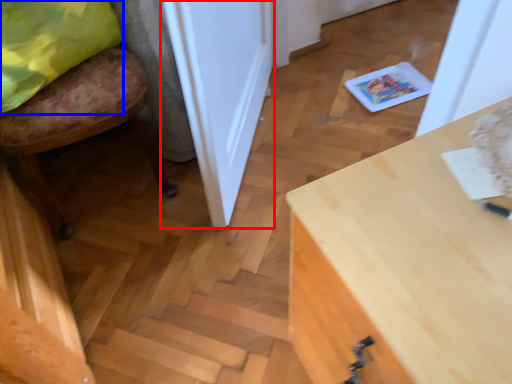
Question: Which object appears closest to the camera in this image, door (highlighted by a red box) or pillow (highlighted by a blue box)?

Choices:
 (A) door
 (B) pillow

Answer: (A)